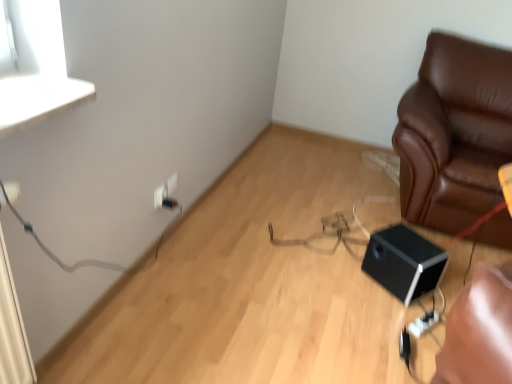
Question: From a real-world perspective, is black plastic electric outlet at lower left, the second electric outlet in the front-to-back sequence, physically located above or below black matte speaker at lower right?

Choices:
 (A) above
 (B) below

Answer: (A)

Question: Based on their positions, is black plastic electric outlet at lower left, the second electric outlet in the front-to-back sequence, located to the left or right of black matte speaker at lower right?

Choices:
 (A) left
 (B) right

Answer: (A)

Question: Considering the real-world distances, which object is farthest from the black plastic electric outlet at lower left, the second electric outlet in the front-to-back sequence?

Choices:
 (A) white plastic electric outlet at upper center, the 1th electric outlet viewed from the front
 (B) black matte speaker at lower right
 (C) brown leather couch at right
 (D) white plastic electric outlet at lower left, which is the 1th electric outlet from back to front

Answer: (C)

Question: Which is nearer to the black plastic electric outlet at lower left, the 2th electric outlet when ordered from back to front?

Choices:
 (A) white plastic electric outlet at upper center, marked as the third electric outlet in a back-to-front arrangement
 (B) white plastic electric outlet at lower left, which is the 1th electric outlet from back to front
 (C) black matte speaker at lower right
 (D) brown leather couch at right

Answer: (A)